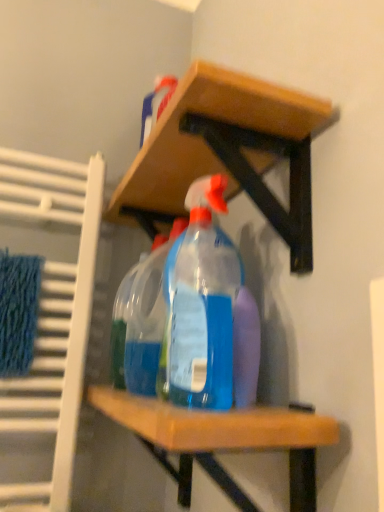
Question: From the image's perspective, would you say blue knitted bath towel at left is positioned over transparent plastic spray bottle at center, which appears as the second bottle when viewed from the back?

Choices:
 (A) no
 (B) yes

Answer: (A)

Question: Can you confirm if blue knitted bath towel at left is bigger than transparent plastic spray bottle at center, marked as the first bottle in a front-to-back arrangement?

Choices:
 (A) yes
 (B) no

Answer: (B)

Question: Is blue knitted bath towel at left touching transparent plastic spray bottle at center, marked as the first bottle in a front-to-back arrangement?

Choices:
 (A) no
 (B) yes

Answer: (A)

Question: From a real-world perspective, does blue knitted bath towel at left sit lower than transparent plastic spray bottle at center, which appears as the second bottle when viewed from the back?

Choices:
 (A) yes
 (B) no

Answer: (A)

Question: From a real-world perspective, does blue knitted bath towel at left stand above transparent plastic spray bottle at center, marked as the first bottle in a front-to-back arrangement?

Choices:
 (A) no
 (B) yes

Answer: (A)

Question: Does blue knitted bath towel at left contain transparent plastic spray bottle at center, which appears as the second bottle when viewed from the back?

Choices:
 (A) no
 (B) yes

Answer: (A)

Question: Considering the relative sizes of transparent plastic spray bottle at center, which ranks as the 1th bottle in back-to-front order, and transparent plastic spray bottle at center, marked as the first bottle in a front-to-back arrangement, in the image provided, is transparent plastic spray bottle at center, which ranks as the 1th bottle in back-to-front order, wider than transparent plastic spray bottle at center, marked as the first bottle in a front-to-back arrangement,?

Choices:
 (A) no
 (B) yes

Answer: (B)

Question: From the image's perspective, is transparent plastic spray bottle at center, the 2th bottle when ordered from front to back, under transparent plastic spray bottle at center, marked as the first bottle in a front-to-back arrangement?

Choices:
 (A) yes
 (B) no

Answer: (A)

Question: Can you confirm if transparent plastic spray bottle at center, which ranks as the 1th bottle in back-to-front order, is shorter than transparent plastic spray bottle at center, which appears as the second bottle when viewed from the back?

Choices:
 (A) no
 (B) yes

Answer: (B)

Question: Does transparent plastic spray bottle at center, which ranks as the 1th bottle in back-to-front order, have a lesser width compared to transparent plastic spray bottle at center, which appears as the second bottle when viewed from the back?

Choices:
 (A) yes
 (B) no

Answer: (B)

Question: Would you say transparent plastic spray bottle at center, which ranks as the 1th bottle in back-to-front order, is a long distance from transparent plastic spray bottle at center, which appears as the second bottle when viewed from the back?

Choices:
 (A) no
 (B) yes

Answer: (A)

Question: From a real-world perspective, is transparent plastic spray bottle at center, the 2th bottle when ordered from front to back, over transparent plastic spray bottle at center, which appears as the second bottle when viewed from the back?

Choices:
 (A) no
 (B) yes

Answer: (A)

Question: Does transparent plastic spray bottle at center, the 2th bottle when ordered from front to back, come behind wooden shelf at upper center?

Choices:
 (A) no
 (B) yes

Answer: (B)